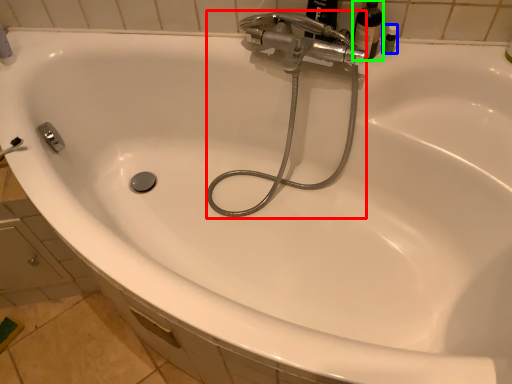
Question: Which object is the closest to the plumbing fixture (highlighted by a red box)? Choose among these: toiletry (highlighted by a blue box) or bottle (highlighted by a green box).

Choices:
 (A) toiletry
 (B) bottle

Answer: (B)